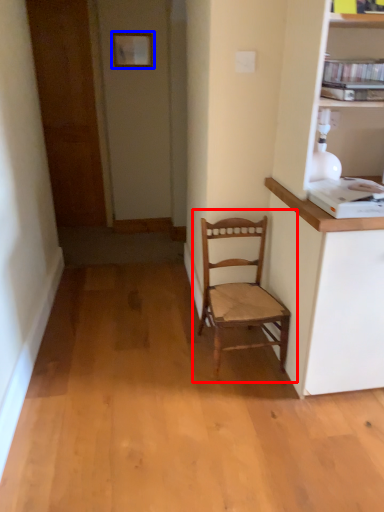
Question: Among these objects, which one is nearest to the camera, chair (highlighted by a red box) or picture frame (highlighted by a blue box)?

Choices:
 (A) chair
 (B) picture frame

Answer: (A)